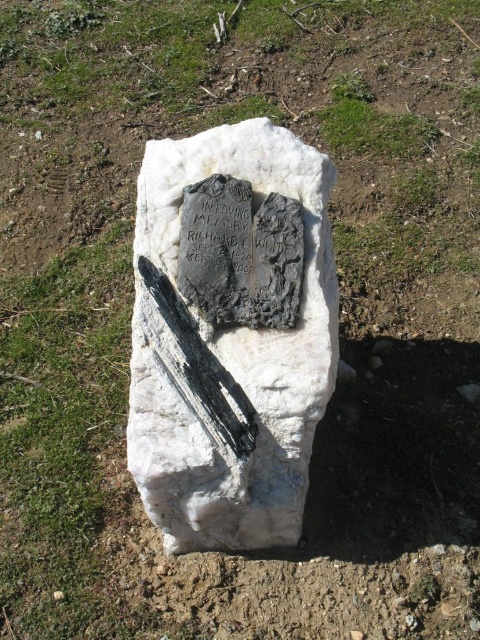
Is white marble stone at center shorter than black polished blade at center?

No, white marble stone at center is not shorter than black polished blade at center.

Can you confirm if white marble stone at center is wider than black polished blade at center?

Indeed, white marble stone at center has a greater width compared to black polished blade at center.

Who is more distant from viewer, [151,177] or [173,308]?

Point [151,177]

Where is `white marble stone at center`? The width and height of the screenshot is (480, 640). white marble stone at center is located at coordinates (230, 353).